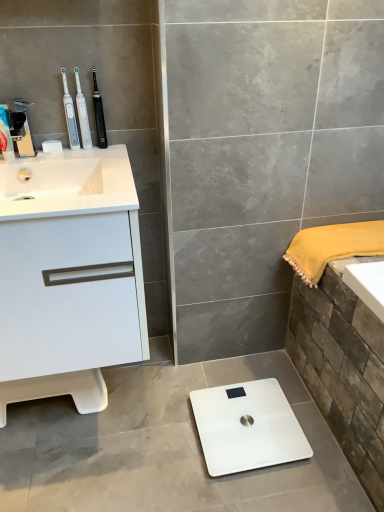
Question: Looking at their shapes, would you say brushed metal faucet at upper left, the 1th toiletry positioned from the right, is wider or thinner than matte plastic toothpaste tube at left, the first toiletry when ordered from left to right?

Choices:
 (A) wide
 (B) thin

Answer: (A)

Question: From a real-world perspective, is brushed metal faucet at upper left, which is the 2th toiletry from left to right, above or below matte plastic toothpaste tube at left, the 2th toiletry viewed from the right?

Choices:
 (A) below
 (B) above

Answer: (B)

Question: Considering the real-world distances, which object is closest to the white plastic toothbrush at upper left, the 2th toothbrush when ordered from right to left?

Choices:
 (A) white glossy cabinet at left
 (B) brushed metal faucet at upper left, the 1th toiletry positioned from the right
 (C) white glossy sink at upper left
 (D) white glossy scale at center
 (E) black plastic toothbrush at upper center, which is the 1th toothbrush in right-to-left order

Answer: (E)

Question: Estimate the real-world distances between objects in this image. Which object is closer to the yellow fluffy towel at right?

Choices:
 (A) brushed metal faucet at upper left, the 1th toiletry positioned from the right
 (B) white plastic toothbrush at upper left, which ranks as the second toothbrush in left-to-right order
 (C) black plastic toothbrush at upper center, acting as the 3th toothbrush starting from the left
 (D) white glossy cabinet at left
 (E) matte plastic toothpaste tube at left, the 2th toiletry viewed from the right

Answer: (D)